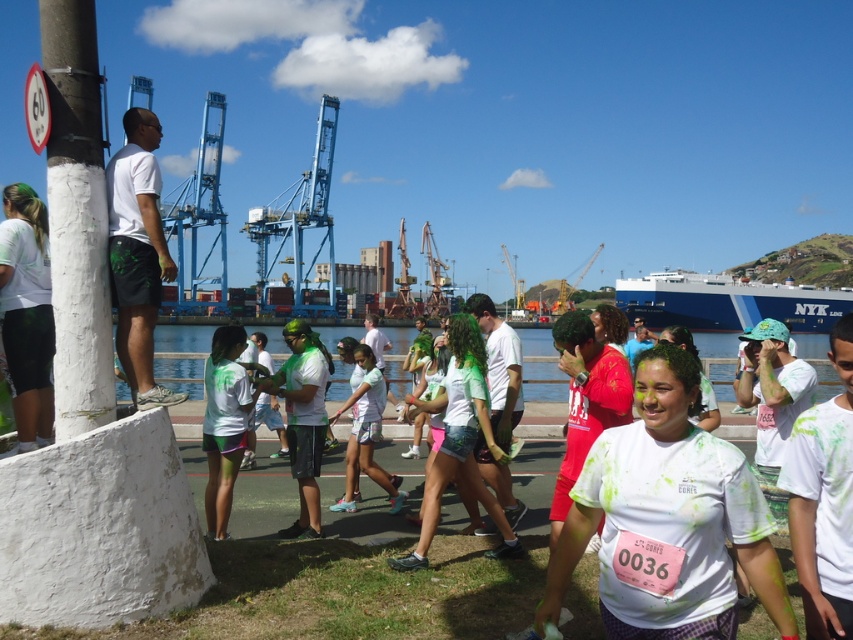
You are organizing a color run event and need to ensure that participants can move freely between the white matte shirt at center and the matte green shirt at center. Based on the scene description, is there enough space for a participant to walk between them?

The white matte shirt at center might be wider than the matte green shirt at center, so there may not be enough space for a participant to walk between them. It is recommended to check the actual distance before allowing participants to move through this area.

You are a photographer standing at the harbor event. You see the white matte shorts at left and the blue matte container ship at center. Which object is closer to the ground?

The white matte shorts at left is positioned under the blue matte container ship at center, so it is closer to the ground.

Based on the photo, you are a photographer at the event and need to capture a photo where both the white matte shirt at center and the matte green shirt at center are visible. Based on their heights, which shirt will appear larger in the photo?

The white matte shirt at center is taller than the matte green shirt at center, so it will appear larger in the photo.